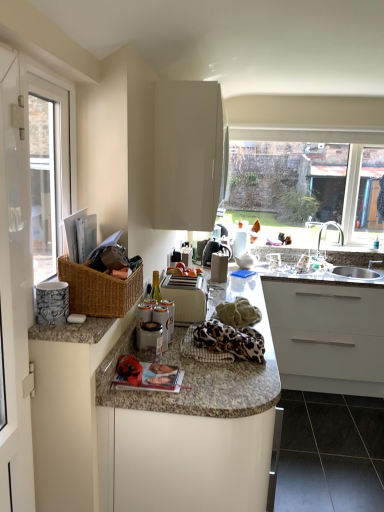
Question: Is porcelain blue and white mug at left, which is counted as the second appliance, starting from the back, outside black glossy tile at lower right?

Choices:
 (A) yes
 (B) no

Answer: (A)

Question: Is porcelain blue and white mug at left, the first appliance viewed from the front, further to camera compared to black glossy tile at lower right?

Choices:
 (A) yes
 (B) no

Answer: (B)

Question: Does porcelain blue and white mug at left, which is counted as the second appliance, starting from the back, come in front of black glossy tile at lower right?

Choices:
 (A) no
 (B) yes

Answer: (B)

Question: Considering the relative sizes of porcelain blue and white mug at left, which is counted as the second appliance, starting from the back, and black glossy tile at lower right in the image provided, is porcelain blue and white mug at left, which is counted as the second appliance, starting from the back, taller than black glossy tile at lower right?

Choices:
 (A) yes
 (B) no

Answer: (A)

Question: Is porcelain blue and white mug at left, marked as the first appliance in a left-to-right arrangement, next to black glossy tile at lower right and touching it?

Choices:
 (A) no
 (B) yes

Answer: (A)

Question: Would you say white glossy screen door at left is to the left or to the right of black glossy tile at lower right in the picture?

Choices:
 (A) right
 (B) left

Answer: (B)

Question: Is white glossy screen door at left in front of or behind black glossy tile at lower right in the image?

Choices:
 (A) behind
 (B) front

Answer: (B)

Question: From a real-world perspective, relative to black glossy tile at lower right, is white glossy screen door at left vertically above or below?

Choices:
 (A) below
 (B) above

Answer: (B)

Question: Is white glossy screen door at left situated inside black glossy tile at lower right or outside?

Choices:
 (A) outside
 (B) inside

Answer: (A)

Question: Would you say white glossy cabinet at upper center, positioned as the 1th cabinetry in top-to-bottom order, is inside or outside granite countertop at center, which ranks as the first cabinetry in bottom-to-top order?

Choices:
 (A) outside
 (B) inside

Answer: (A)

Question: From the image's perspective, is white glossy cabinet at upper center, positioned as the 1th cabinetry in top-to-bottom order, located above or below granite countertop at center, arranged as the second cabinetry when viewed from the top?

Choices:
 (A) above
 (B) below

Answer: (A)

Question: In the image, is white glossy cabinet at upper center, positioned as the 1th cabinetry in top-to-bottom order, on the left side or the right side of granite countertop at center, arranged as the second cabinetry when viewed from the top?

Choices:
 (A) right
 (B) left

Answer: (B)

Question: Is point (178, 104) positioned closer to the camera than point (144, 419)?

Choices:
 (A) closer
 (B) farther

Answer: (B)

Question: From their relative heights in the image, would you say silver metallic sink at right is taller or shorter than porcelain blue and white mug at left, the first appliance viewed from the front?

Choices:
 (A) tall
 (B) short

Answer: (A)

Question: Looking at the image, does silver metallic sink at right seem bigger or smaller compared to porcelain blue and white mug at left, the first appliance viewed from the front?

Choices:
 (A) small
 (B) big

Answer: (B)